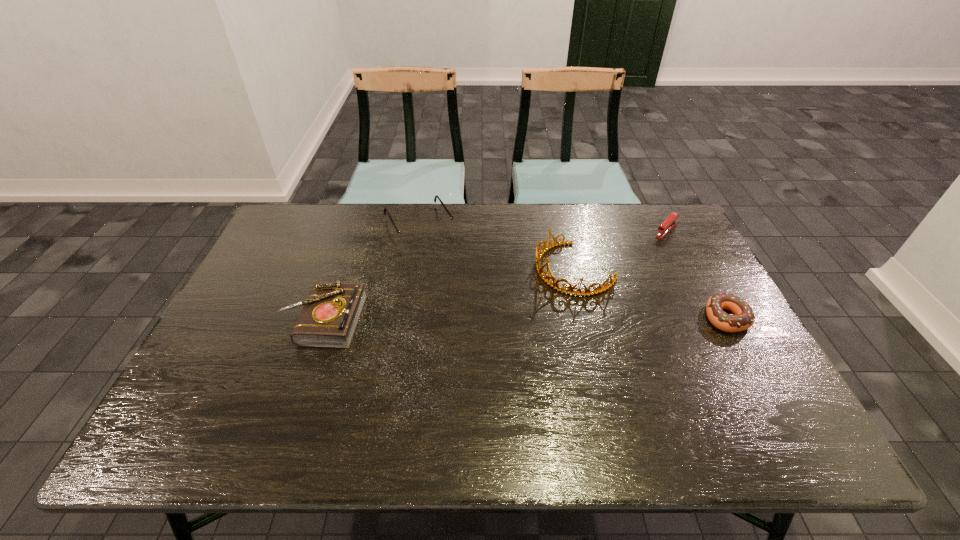
Identify the location of free space located on the front-facing side of the tiara. This screenshot has height=540, width=960. (528, 294).

Image resolution: width=960 pixels, height=540 pixels. In order to click on vacant space located on the front-facing side of the stapler in this screenshot , I will do `click(634, 264)`.

Where is `free space located 0.320m on the front-facing side of the stapler`? free space located 0.320m on the front-facing side of the stapler is located at coordinates (611, 288).

Where is `vacant space located on the front-facing side of the stapler`? This screenshot has height=540, width=960. vacant space located on the front-facing side of the stapler is located at coordinates (605, 293).

Identify the location of free space located at the hinge ends of the spectacles. The image size is (960, 540). (485, 333).

Identify the location of free space located at the hinge ends of the spectacles. (458, 289).

You are a GUI agent. You are given a task and a screenshot of the screen. Output one action in this format:
    pyautogui.click(x=<x>, y=<y>)
    Task: Click on the free region located 0.050m at the hinge ends of the spectacles
    
    Given the screenshot: What is the action you would take?
    pyautogui.click(x=437, y=254)

Find the location of a particular element. The width and height of the screenshot is (960, 540). tiara that is at the far edge is located at coordinates (539, 254).

This screenshot has height=540, width=960. I want to click on stapler that is positioned at the far edge, so click(x=668, y=224).

Locate an element on the screen. This screenshot has width=960, height=540. spectacles present at the far edge is located at coordinates (410, 235).